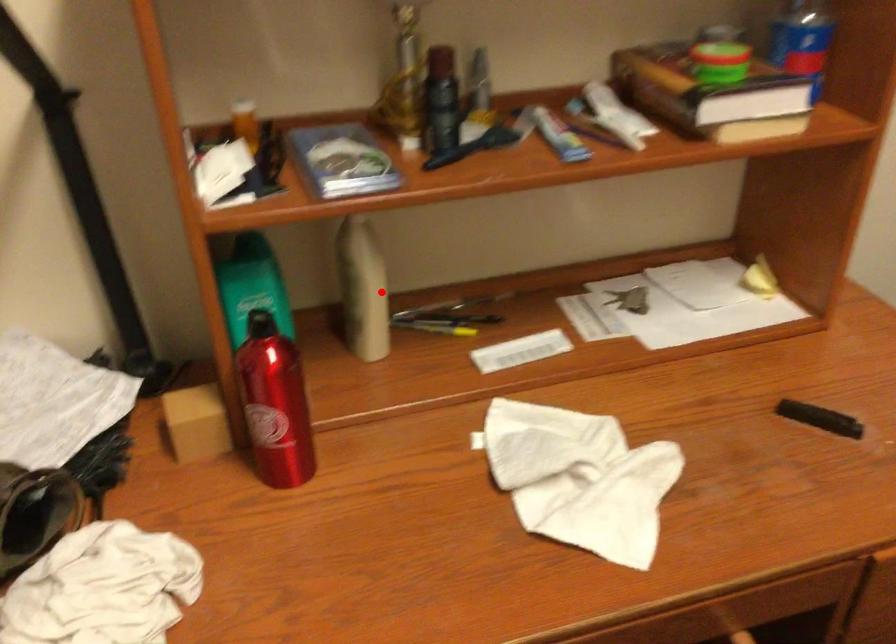
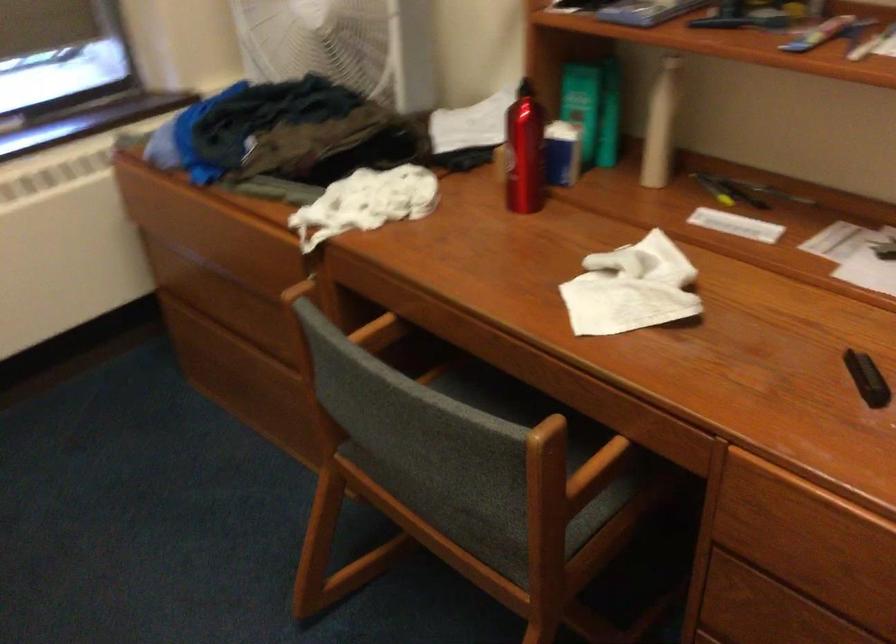
Question: I am providing you with two images of the same scene from different viewpoints. Image1 has a red point marked. In image2, the corresponding 3D location appears at what relative position? Reply with the corresponding letter.

Choices:
 (A) Closer
 (B) Farther

Answer: (B)